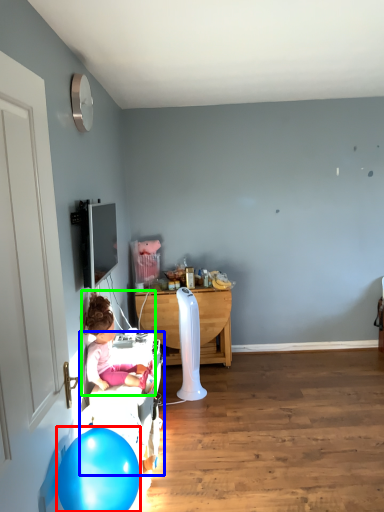
Question: Which is nearer to the balloon (highlighted by a red box)? bed frame (highlighted by a blue box) or person (highlighted by a green box).

Choices:
 (A) bed frame
 (B) person

Answer: (A)